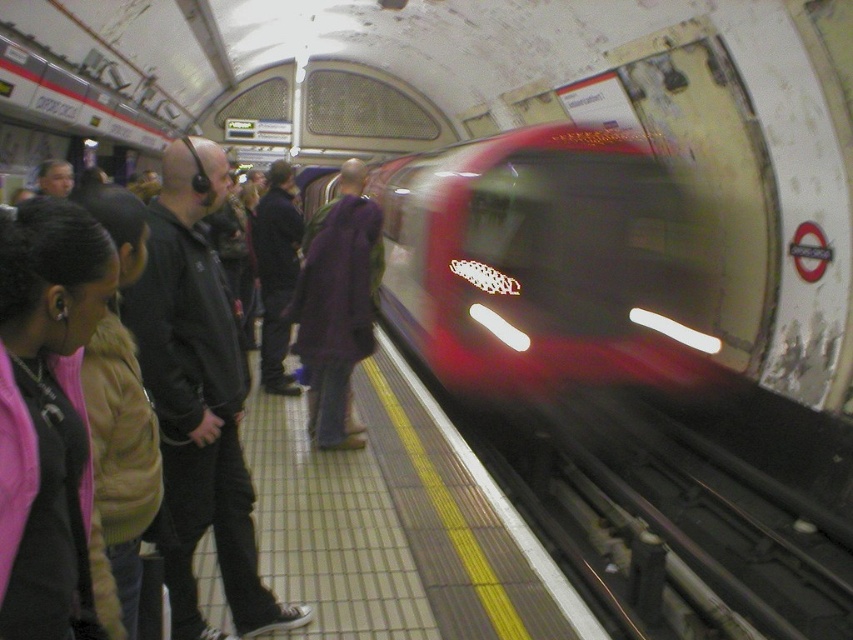
Question: Which of these objects is positioned closest to the purple fabric jacket at center?

Choices:
 (A) black leather jacket at left
 (B) purple wool coat at center

Answer: (B)

Question: Can you confirm if black leather jacket at left is smaller than purple wool coat at center?

Choices:
 (A) no
 (B) yes

Answer: (B)

Question: Estimate the real-world distances between objects in this image. Which object is closer to the purple fabric jacket at center?

Choices:
 (A) purple wool coat at center
 (B) black leather jacket at left

Answer: (A)

Question: Is black leather jacket at left positioned at the back of purple fabric jacket at center?

Choices:
 (A) yes
 (B) no

Answer: (B)

Question: Which of the following is the farthest from the observer?

Choices:
 (A) purple wool coat at center
 (B) purple fabric jacket at center

Answer: (B)

Question: Is black leather jacket at left below purple wool coat at center?

Choices:
 (A) yes
 (B) no

Answer: (A)